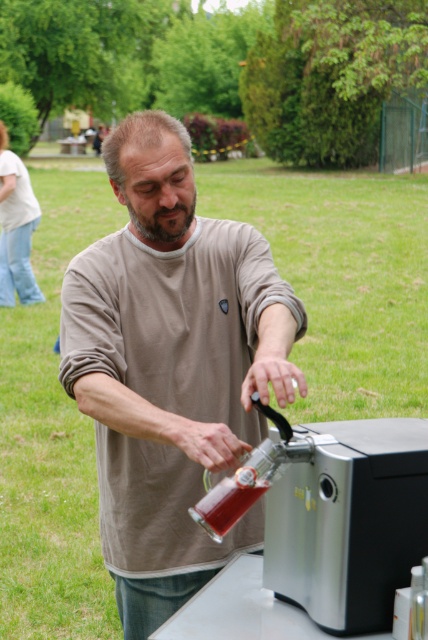
Question: Is matte brown shirt at center further to the viewer compared to translucent glass bottle at center?

Choices:
 (A) yes
 (B) no

Answer: (B)

Question: Can you confirm if matte brown shirt at center is positioned to the right of translucent glass bottle at center?

Choices:
 (A) no
 (B) yes

Answer: (A)

Question: Which point is closer to the camera?

Choices:
 (A) (127, 237)
 (B) (229, 490)

Answer: (B)

Question: Can you confirm if matte brown shirt at center is smaller than translucent glass bottle at center?

Choices:
 (A) no
 (B) yes

Answer: (A)